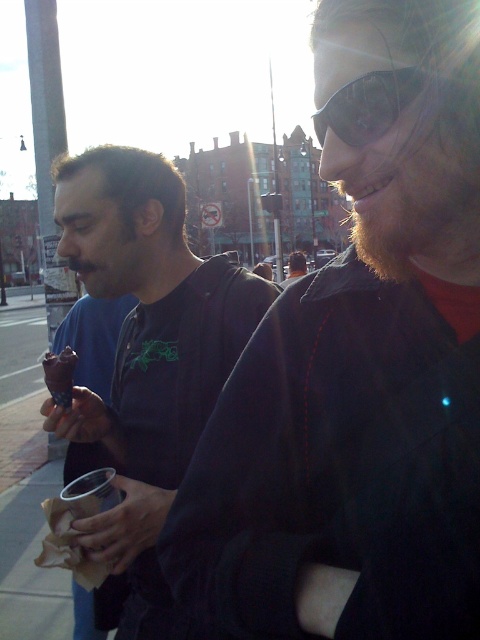
Is black matte jacket at center below matte black jacket at center?

Yes.

Which is behind, point (343, 298) or point (295, 252)?

Point (295, 252)

Is point (424, 4) farther from viewer compared to point (303, 264)?

That is False.

The width and height of the screenshot is (480, 640). Find the location of `black matte jacket at center`. black matte jacket at center is located at coordinates (359, 365).

Does black matte jacket at center have a greater height compared to matte black jacket at left?

In fact, black matte jacket at center may be shorter than matte black jacket at left.

Between black matte jacket at center and matte black jacket at left, which one is positioned lower?

Positioned lower is matte black jacket at left.

Which is behind, point (295, 563) or point (157, 432)?

The point (157, 432) is more distant.

Identify the location of black matte jacket at center. (359, 365).

Between black matte jacket at center and chocolate ice cream at lower left, which one has more height?

black matte jacket at center

What do you see at coordinates (359, 365) in the screenshot? Image resolution: width=480 pixels, height=640 pixels. I see `black matte jacket at center` at bounding box center [359, 365].

Does point (359, 29) come closer to viewer compared to point (69, 372)?

Yes, it is.

I want to click on black matte jacket at center, so click(359, 365).